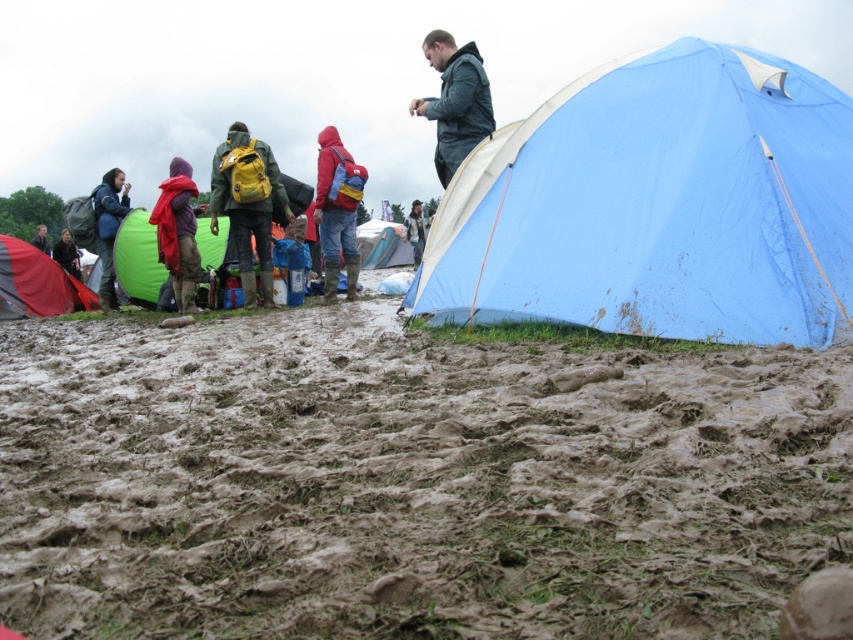
Question: Which point is closer to the camera taking this photo?

Choices:
 (A) (393, 241)
 (B) (190, 301)

Answer: (B)

Question: Can you confirm if red matte jacket at center is positioned above red woolen scarf at left?

Choices:
 (A) yes
 (B) no

Answer: (A)

Question: Based on their relative distances, which object is nearer to the dark green jacket at upper center?

Choices:
 (A) red matte jacket at center
 (B) dark blue jacket at lower left
 (C) red fabric tent at lower left
 (D) green fabric tent at center

Answer: (A)

Question: Can you confirm if denim jacket at center is positioned above red fabric jacket at upper left?

Choices:
 (A) no
 (B) yes

Answer: (B)

Question: Is red fabric tent at lower left positioned at the back of blue tarpaulin tent at center?

Choices:
 (A) yes
 (B) no

Answer: (B)

Question: Which point is farther to the camera?

Choices:
 (A) red fabric tent at lower left
 (B) blue tarpaulin tent at center
 (C) red matte jacket at center
 (D) dark green jacket at upper center

Answer: (B)